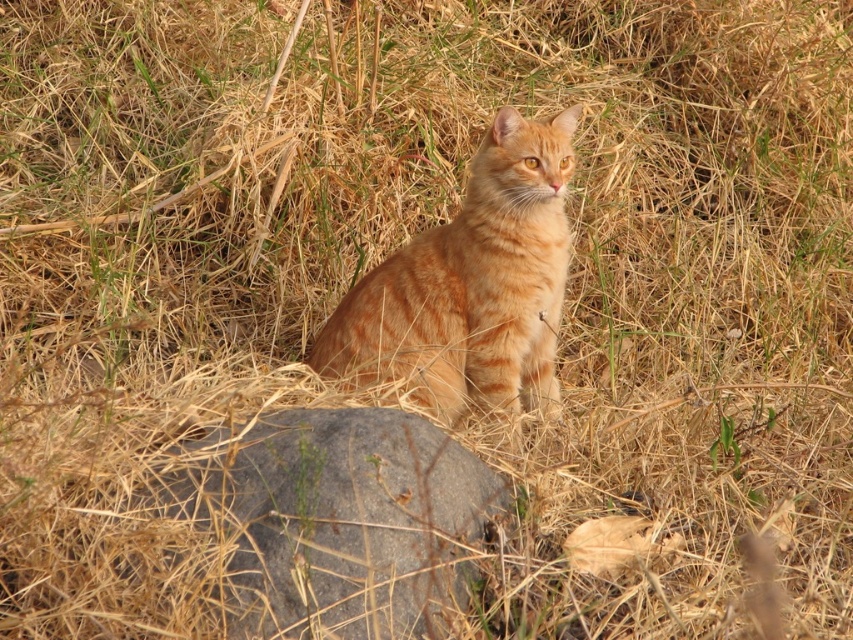
Question: Does gray rough stone at lower center appear on the left side of orange fur cat at center?

Choices:
 (A) yes
 (B) no

Answer: (A)

Question: Is gray rough stone at lower center to the left of orange fur cat at center from the viewer's perspective?

Choices:
 (A) yes
 (B) no

Answer: (A)

Question: Which point appears farthest from the camera in this image?

Choices:
 (A) (263, 531)
 (B) (547, 138)

Answer: (B)

Question: Among these points, which one is nearest to the camera?

Choices:
 (A) (409, 376)
 (B) (257, 556)

Answer: (B)

Question: Does gray rough stone at lower center have a larger size compared to orange fur cat at center?

Choices:
 (A) no
 (B) yes

Answer: (A)